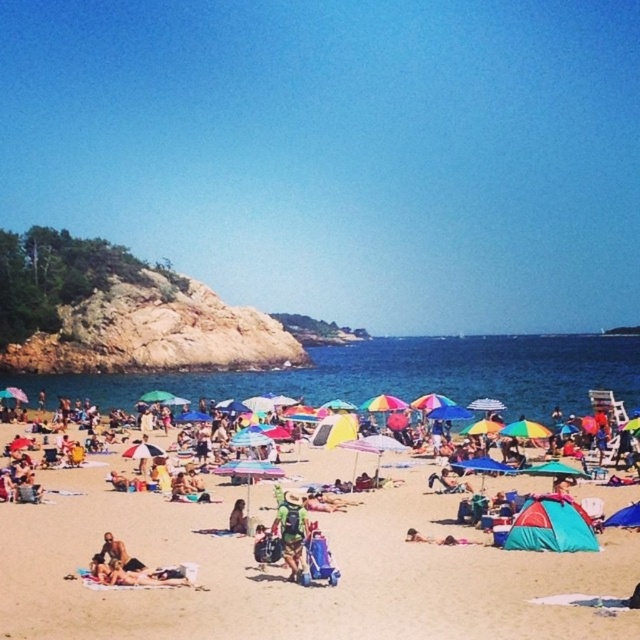
Question: Is camouflage backpack at center below tan skin person at center?

Choices:
 (A) yes
 (B) no

Answer: (A)

Question: Is beach umbrella at center bigger than tan skin person at center?

Choices:
 (A) no
 (B) yes

Answer: (B)

Question: Which object appears farthest from the camera in this image?

Choices:
 (A) tan skin person at center
 (B) camouflage backpack at center

Answer: (A)

Question: Which point appears closest to the camera in this image?

Choices:
 (A) (528, 568)
 (B) (243, 524)
 (C) (285, 547)

Answer: (C)

Question: Which object appears closest to the camera in this image?

Choices:
 (A) beach umbrella at center
 (B) tan skin person at center
 (C) camouflage backpack at center

Answer: (A)

Question: From the image, what is the correct spatial relationship of beach umbrella at center in relation to camouflage backpack at center?

Choices:
 (A) right
 (B) left

Answer: (B)